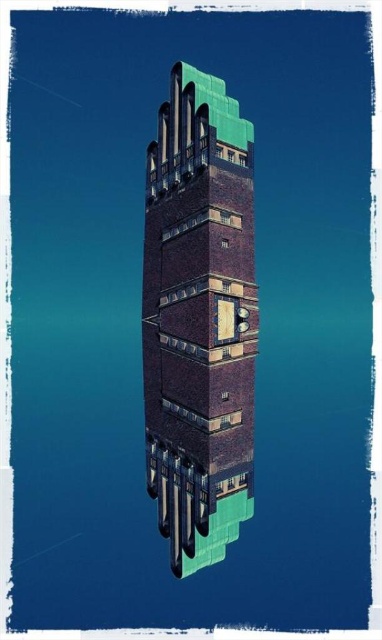
You are standing at the entrance of a park and see the brown brick tower at center. If you move 0.3 units to the right along the x axis, will you be closer to the tower?

Moving 0.3 units to the right along the x axis will not change your distance to the brown brick tower at center because the tower is located at a fixed position at point (200,320). Your movement is only along the x axis and does not affect the distance in the y axis.

You are an architect reviewing blueprints of a building. You notice the brown brick tower at center and green glossy pipes at lower center. According to the blueprint, which object is positioned closer to the front of the structure?

The brown brick tower at center is closer to the front of the structure because the green glossy pipes at lower center are positioned behind it.

You are an architect inspecting the structural integrity of the brown brick tower at center and the green glossy pipes at lower center. Based on their positions, which object is situated higher in the image?

The brown brick tower at center is located above the green glossy pipes at lower center, so it is situated higher in the image.